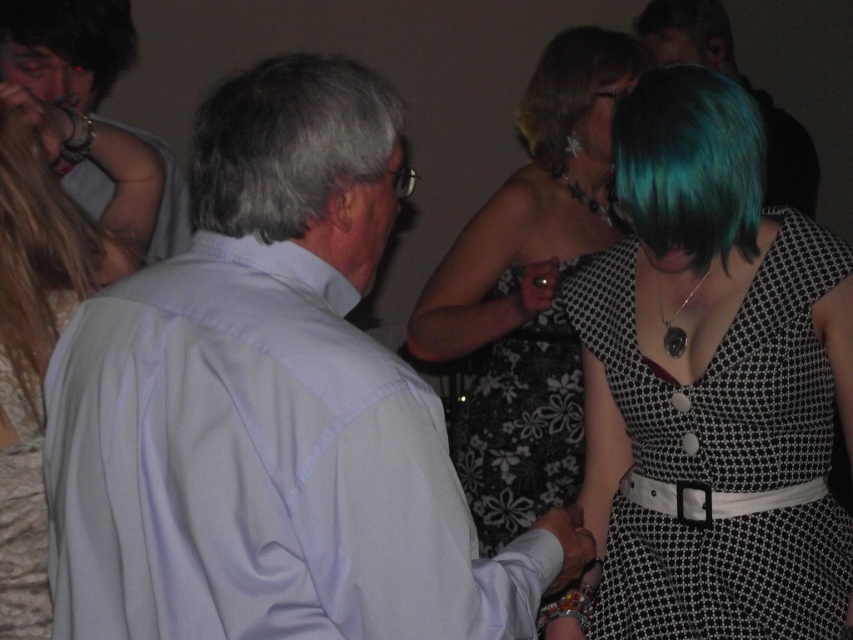
Does matte gray shirt at upper left appear on the right side of matte white hand at lower center?

No, matte gray shirt at upper left is not to the right of matte white hand at lower center.

Is point (126, 132) positioned after point (569, 566)?

Yes, point (126, 132) is behind point (569, 566).

Image resolution: width=853 pixels, height=640 pixels. Identify the location of matte gray shirt at upper left. (90, 84).

Is black floral dress at center above blonde hair at left?

Actually, black floral dress at center is below blonde hair at left.

Is black floral dress at center bigger than blonde hair at left?

Indeed, black floral dress at center has a larger size compared to blonde hair at left.

Is point (461, 378) positioned in front of point (33, 360)?

No, (461, 378) is further to viewer.

Find the location of a particular element. This screenshot has width=853, height=640. black floral dress at center is located at coordinates (518, 426).

Does light blue shirt at center appear on the right side of floral-patterned dress at center?

No, light blue shirt at center is not to the right of floral-patterned dress at center.

In the scene shown: Who is lower down, light blue shirt at center or floral-patterned dress at center?

light blue shirt at center is lower down.

Does point (207, 204) come in front of point (473, 472)?

Yes, it is.

You are a GUI agent. You are given a task and a screenshot of the screen. Output one action in this format:
    pyautogui.click(x=<x>, y=<y>)
    Task: Click on the light blue shirt at center
    This screenshot has height=640, width=853.
    Given the screenshot: What is the action you would take?
    pyautogui.click(x=267, y=406)